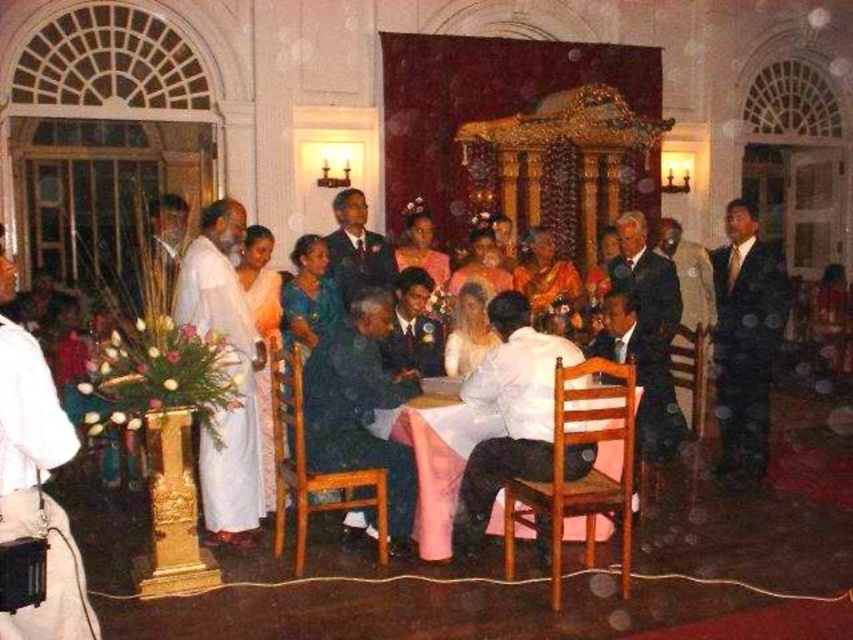
You are a photographer at the event and need to position your camera to capture the bride in the white satin dress at center. According to the coordinates provided, where should you aim your camera to ensure the dress is centered in the frame?

You should aim your camera at the coordinates point (509,412) to ensure the white satin dress at center is perfectly centered in the frame.